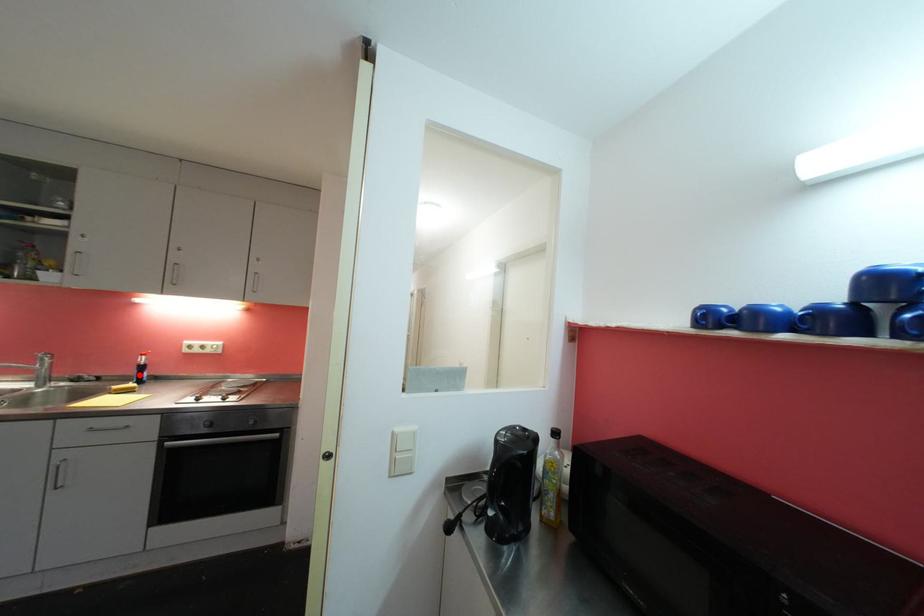
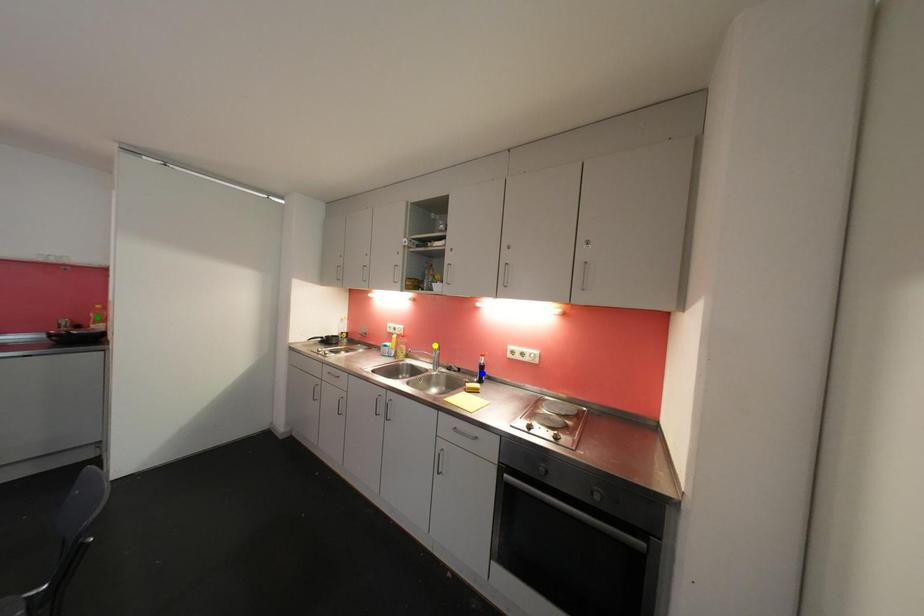
Question: I am providing you with two images of the same scene from different viewpoints. A red point is marked on the first image. You are given multiple points on the second image. Which mark in image 2 goes with the point in image 1?

Choices:
 (A) yellow point
 (B) blue point
 (C) green point

Answer: (B)